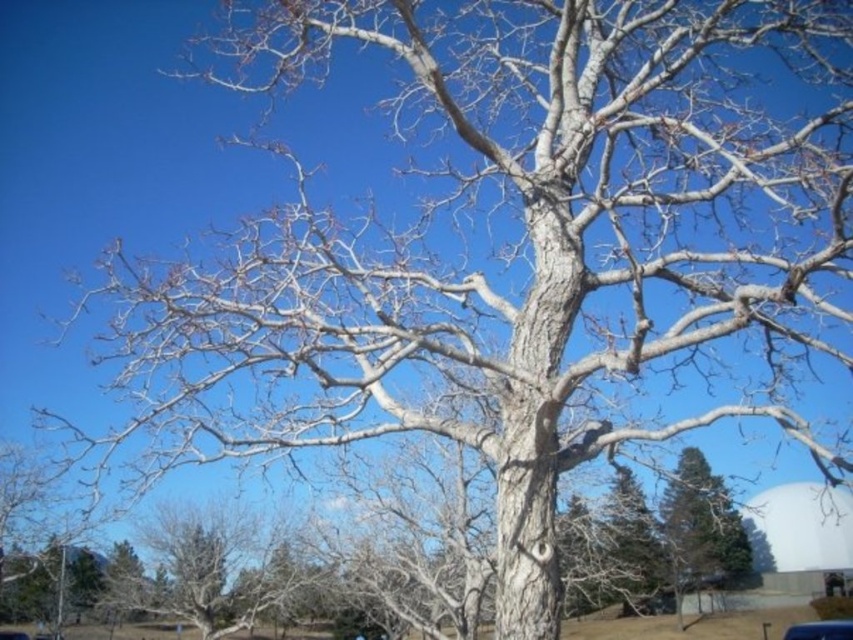
Describe the element at coordinates (701, 529) in the screenshot. I see `smooth bark tree at lower right` at that location.

Is point (722, 493) positioned after point (782, 634)?

No, (722, 493) is closer to viewer.

Where is `smooth bark tree at lower right`? Image resolution: width=853 pixels, height=640 pixels. smooth bark tree at lower right is located at coordinates (701, 529).